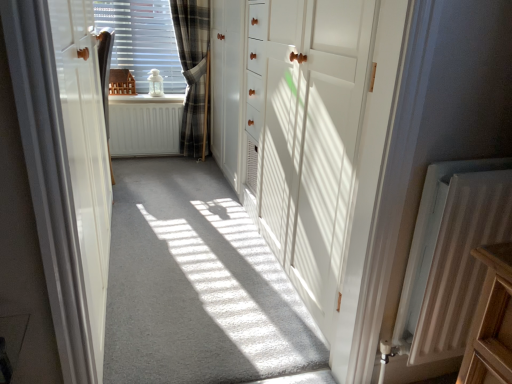
Find the location of a particular element. vacant area on top of translucent plastic window at center (from a real-world perspective) is located at coordinates (152, 1).